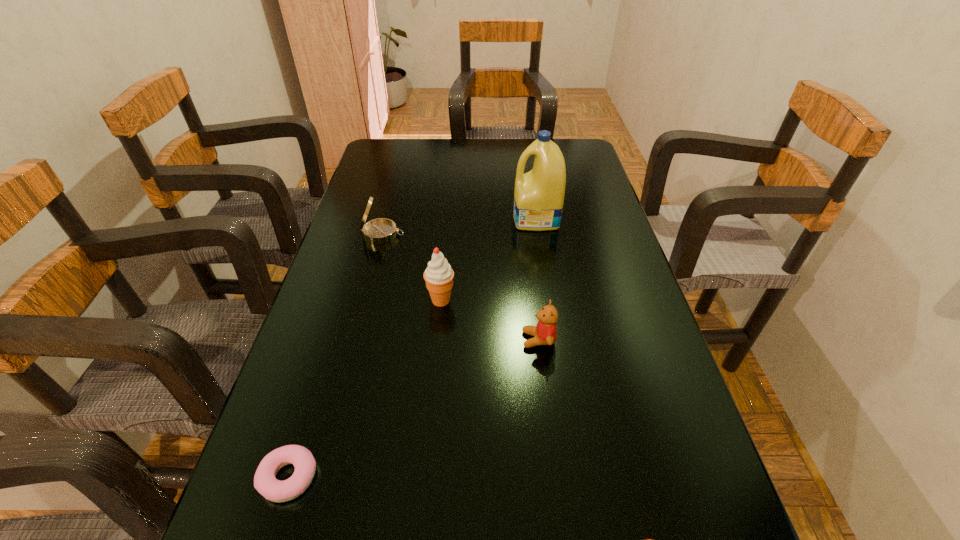
Find the location of a particular element. This screenshot has height=540, width=960. vacant space located 0.400m on the label of the detergent is located at coordinates (376, 219).

Locate an element on the screen. The width and height of the screenshot is (960, 540). blank space located 0.360m on the right of the fourth object from right to left is located at coordinates (608, 300).

The image size is (960, 540). Identify the location of vacant point located with the dial facing the farther compass. (507, 234).

The width and height of the screenshot is (960, 540). What are the coordinates of `free space located 0.230m on the front-facing side of the teddy bear` in the screenshot? It's located at (417, 340).

You are a GUI agent. You are given a task and a screenshot of the screen. Output one action in this format:
    pyautogui.click(x=<x>, y=<y>)
    Task: Click on the vacant space located on the front-facing side of the teddy bear
    The height and width of the screenshot is (540, 960).
    Given the screenshot: What is the action you would take?
    pyautogui.click(x=412, y=340)

Find the location of a particular element. This screenshot has width=960, height=540. free space located on the front-facing side of the teddy bear is located at coordinates (362, 340).

Locate an element on the screen. The image size is (960, 540). free space located on the back of the pastry is located at coordinates (341, 312).

You are a GUI agent. You are given a task and a screenshot of the screen. Output one action in this format:
    pyautogui.click(x=<x>, y=<y>)
    Task: Click on the compass present at the left edge
    This screenshot has width=960, height=540.
    Given the screenshot: What is the action you would take?
    pyautogui.click(x=381, y=230)

I want to click on pastry situated at the left edge, so click(265, 483).

You are a GUI agent. You are given a task and a screenshot of the screen. Output one action in this format:
    pyautogui.click(x=<x>, y=<y>)
    Task: Click on the object at the right edge
    The image size is (960, 540).
    Given the screenshot: What is the action you would take?
    pyautogui.click(x=539, y=194)